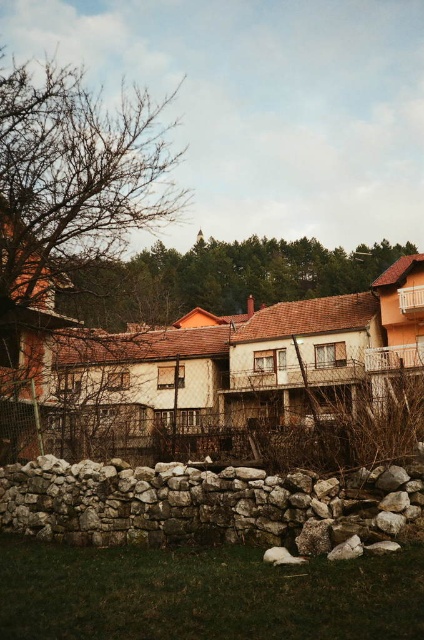
Is gray rough stone wall at lower center above brown textured tree at center?

No.

Can you confirm if gray rough stone wall at lower center is smaller than brown textured tree at center?

Yes, gray rough stone wall at lower center is smaller than brown textured tree at center.

Is point (114, 522) positioned in front of point (354, 253)?

Yes.

What are the coordinates of `gray rough stone wall at lower center` in the screenshot? It's located at (208, 506).

Which is more to the left, bare branches at upper left or gray rough stone wall at lower center?

From the viewer's perspective, bare branches at upper left appears more on the left side.

Between bare branches at upper left and gray rough stone wall at lower center, which one is positioned lower?

Positioned lower is gray rough stone wall at lower center.

The height and width of the screenshot is (640, 424). I want to click on bare branches at upper left, so click(x=72, y=179).

Is point (69, 180) in front of point (217, 264)?

Yes, point (69, 180) is closer to viewer.

Between point (39, 148) and point (262, 296), which one is positioned in front?

Point (39, 148)

Describe the element at coordinates (72, 179) in the screenshot. The width and height of the screenshot is (424, 640). I see `bare branches at upper left` at that location.

In order to click on bare branches at upper left in this screenshot , I will do `click(72, 179)`.